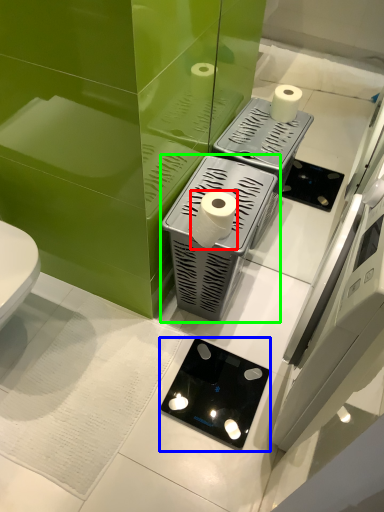
Question: Which is farther away from toilet paper (highlighted by a red box)? appliance (highlighted by a blue box) or appliance (highlighted by a green box)?

Choices:
 (A) appliance
 (B) appliance

Answer: (A)